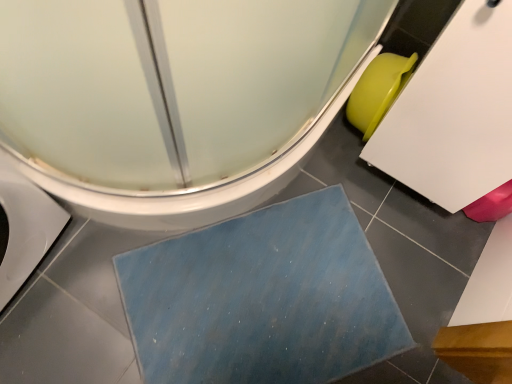
Question: Considering the relative positions of blue textured bath mat at lower center and white glossy toilet at lower left in the image provided, is blue textured bath mat at lower center to the left or to the right of white glossy toilet at lower left?

Choices:
 (A) left
 (B) right

Answer: (B)

Question: Considering their positions, is blue textured bath mat at lower center located in front of or behind white glossy toilet at lower left?

Choices:
 (A) front
 (B) behind

Answer: (B)

Question: Estimate the real-world distances between objects in this image. Which object is closer to the green matte toilet bowl at right?

Choices:
 (A) blue textured bath mat at lower center
 (B) white glossy toilet at lower left

Answer: (B)

Question: Estimate the real-world distances between objects in this image. Which object is closer to the white glossy toilet at lower left?

Choices:
 (A) green matte toilet bowl at right
 (B) blue textured bath mat at lower center

Answer: (B)